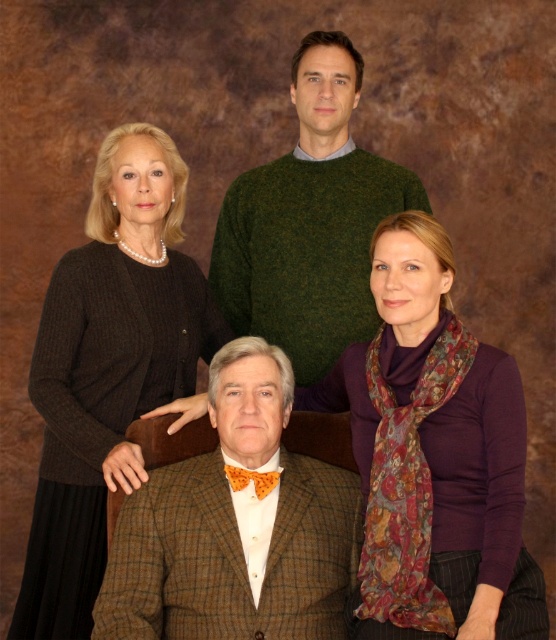
You are standing in front of the group portrait and want to take a closer look at the purple silk scarf at lower right. If you can only move forward 1 meter, will you be able to reach the scarf?

The purple silk scarf at lower right is 1.52 meters away from the viewer. Moving forward 1 meter would leave a remaining distance of 0.52 meters, so you can reach it.

You are organizing a clothing donation drive and need to determine which item takes up more space when folded. Based on the image, which item between the purple silk scarf at lower right and the green wool sweater at upper center is wider?

The green wool sweater at upper center is wider than the purple silk scarf at lower right, so it takes up more space when folded.